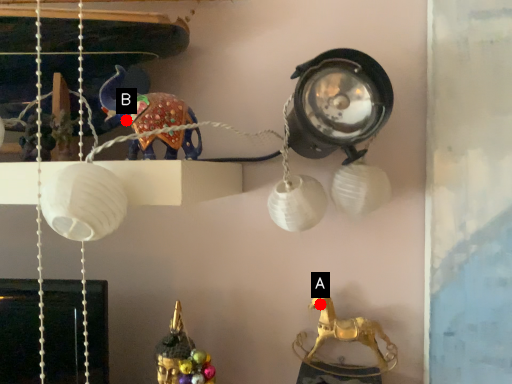
Question: Two points are circled on the image, labeled by A and B beside each circle. Which of the following is the closest to the observer?

Choices:
 (A) A is closer
 (B) B is closer

Answer: (B)